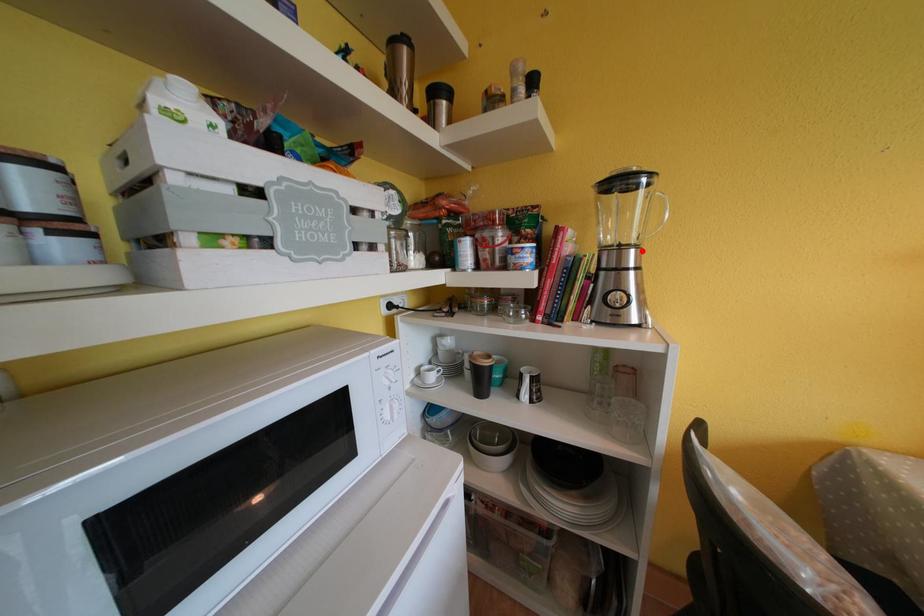
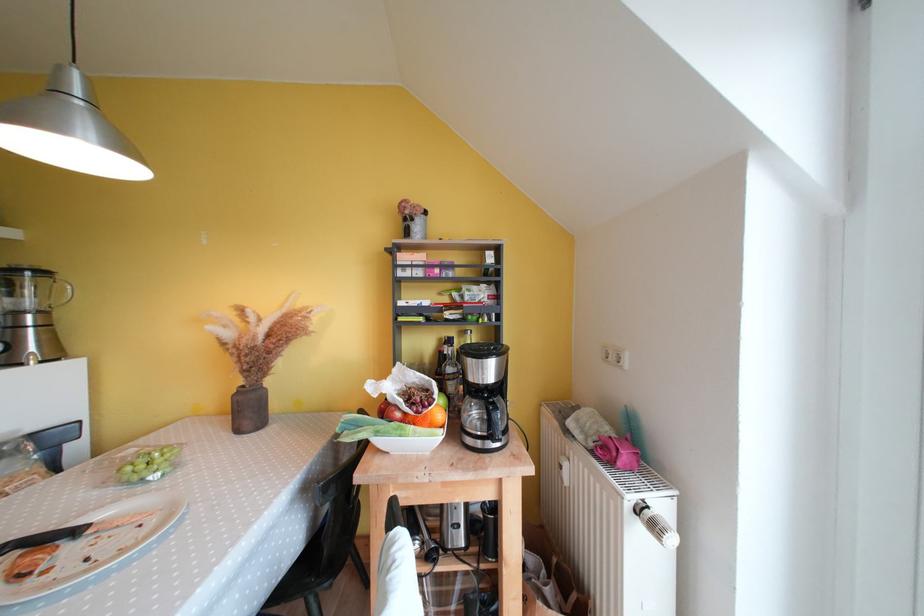
Where in the second image is the point corresponding to the highlighted location from the first image?

(49, 315)